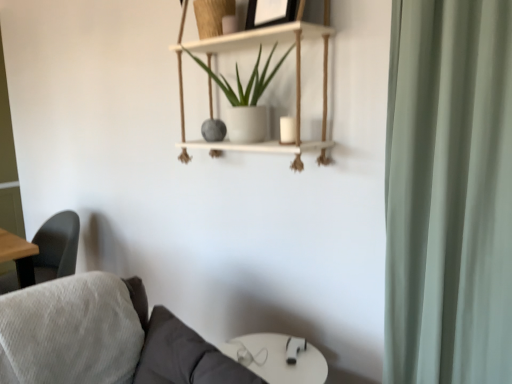
Question: Does white wood shelf at upper center lie in front of wooden picture frame at upper center?

Choices:
 (A) yes
 (B) no

Answer: (A)

Question: Is white wood shelf at upper center oriented away from wooden picture frame at upper center?

Choices:
 (A) no
 (B) yes

Answer: (B)

Question: Does white wood shelf at upper center have a greater height compared to wooden picture frame at upper center?

Choices:
 (A) no
 (B) yes

Answer: (B)

Question: Can you confirm if white wood shelf at upper center is positioned to the left of wooden picture frame at upper center?

Choices:
 (A) no
 (B) yes

Answer: (B)

Question: From a real-world perspective, does white wood shelf at upper center stand above wooden picture frame at upper center?

Choices:
 (A) no
 (B) yes

Answer: (A)

Question: Is white wood shelf at upper center not near wooden picture frame at upper center?

Choices:
 (A) no
 (B) yes

Answer: (A)

Question: Is white wood shelf at upper center positioned with its back to white glossy round table at lower center?

Choices:
 (A) yes
 (B) no

Answer: (B)

Question: Does white wood shelf at upper center have a larger size compared to white glossy round table at lower center?

Choices:
 (A) yes
 (B) no

Answer: (A)

Question: From the image's perspective, is white wood shelf at upper center on white glossy round table at lower center?

Choices:
 (A) yes
 (B) no

Answer: (A)

Question: Would you say white wood shelf at upper center is a long distance from white glossy round table at lower center?

Choices:
 (A) no
 (B) yes

Answer: (A)

Question: Considering the relative positions of white wood shelf at upper center and white glossy round table at lower center in the image provided, is white wood shelf at upper center to the right of white glossy round table at lower center from the viewer's perspective?

Choices:
 (A) yes
 (B) no

Answer: (B)

Question: Considering the relative positions of white wood shelf at upper center and white glossy round table at lower center in the image provided, is white wood shelf at upper center behind white glossy round table at lower center?

Choices:
 (A) yes
 (B) no

Answer: (B)

Question: Is wooden picture frame at upper center in front of white matte pot at upper center?

Choices:
 (A) no
 (B) yes

Answer: (A)